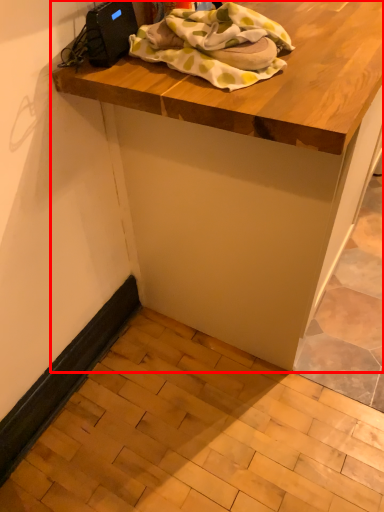
Question: Where is table (annotated by the red box) located in relation to blanket in the image?

Choices:
 (A) left
 (B) right

Answer: (B)